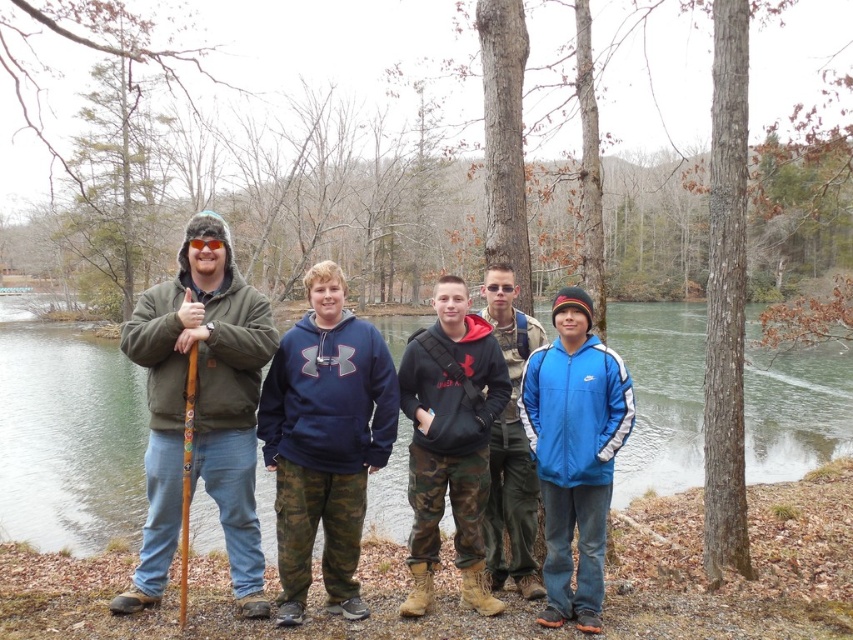
Please look at the image. There is a group of people standing near a lake or river. Among them, the adult male on the left is wearing a dark green jacket, blue jeans, and a fur lined hat. The camo pants at center is represented by point (450, 442). Which person is wearing the camo pants at center?

The camo pants at center is represented by point (450, 442), so the person wearing the camo pants at center is the one located at that coordinate.

You are trying to locate the green matte jacket at left and the navy blue fleece at center in the group. Which one is more to the left?

The green matte jacket at left is more to the left than the navy blue fleece at center.